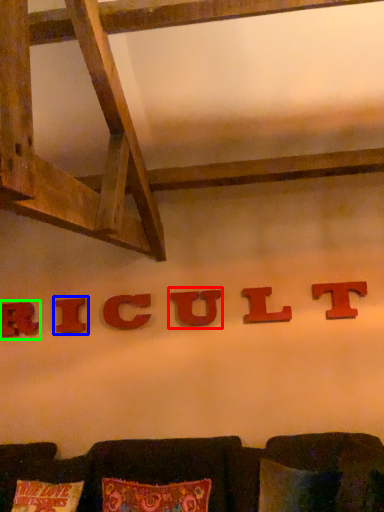
Question: Estimate the real-world distances between objects in this image. Which object is closer to alphabet (highlighted by a red box), alphabet (highlighted by a blue box) or alphabet (highlighted by a green box)?

Choices:
 (A) alphabet
 (B) alphabet

Answer: (A)